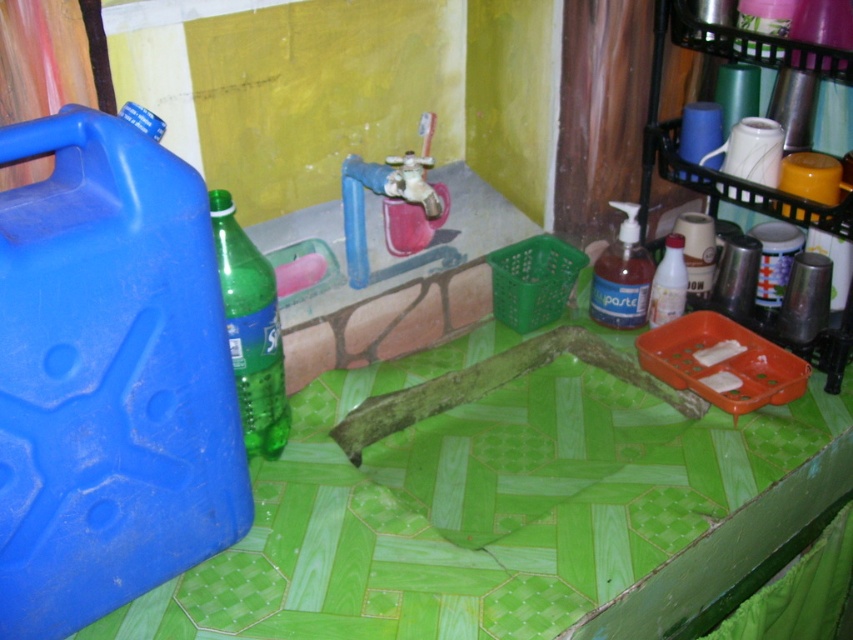
Is green wood table at center shorter than green matte bottle at center?

No, green wood table at center is not shorter than green matte bottle at center.

Identify the location of green wood table at center. The image size is (853, 640). (476, 506).

The height and width of the screenshot is (640, 853). What do you see at coordinates (476, 506) in the screenshot?
I see `green wood table at center` at bounding box center [476, 506].

What are the coordinates of `green wood table at center` in the screenshot? It's located at (476, 506).

Looking at this image, which is below, green matte bottle at center or translucent plastic soap dispenser at center-right?

green matte bottle at center is lower down.

Who is more forward, [235,256] or [619,317]?

Point [235,256] is in front.

Does point (265, 417) come farther from viewer compared to point (625, 262)?

No, (265, 417) is closer to viewer.

Identify the location of green matte bottle at center. Image resolution: width=853 pixels, height=640 pixels. (251, 330).

Does green wood table at center have a greater width compared to translucent plastic bottle at center?

Yes.

Who is more forward, (378,513) or (679,260)?

Point (378,513)

You are a GUI agent. You are given a task and a screenshot of the screen. Output one action in this format:
    pyautogui.click(x=<x>, y=<y>)
    Task: Click on the green wood table at center
    
    Given the screenshot: What is the action you would take?
    pyautogui.click(x=476, y=506)